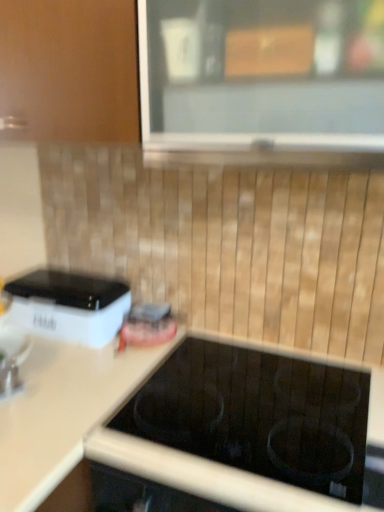
At what (x,y) coordinates should I click in order to perform the action: click on white plastic toaster at left. Please return your answer as a coordinate pair (x, y). Looking at the image, I should click on pyautogui.click(x=69, y=305).

From a real-world perspective, relative to metallic faucet at lower left, is white matte countertop at center vertically above or below?

white matte countertop at center is below metallic faucet at lower left.

Is white matte countertop at center oriented away from metallic faucet at lower left?

No, metallic faucet at lower left is not at the back of white matte countertop at center.

Which is more distant, (x=132, y=382) or (x=25, y=340)?

Positioned behind is point (x=25, y=340).

Is white matte countertop at center situated inside metallic faucet at lower left or outside?

white matte countertop at center exists outside the volume of metallic faucet at lower left.

From a real-world perspective, between white plastic toaster at left and metallic faucet at lower left, who is vertically lower?

From a 3D spatial view, metallic faucet at lower left is below.

Considering the sizes of white plastic toaster at left and metallic faucet at lower left in the image, is white plastic toaster at left bigger or smaller than metallic faucet at lower left?

Considering their sizes, white plastic toaster at left takes up more space than metallic faucet at lower left.

Image resolution: width=384 pixels, height=512 pixels. I want to click on appliance lying on the left of white plastic toaster at left, so click(12, 359).

In the image, is white plastic toaster at left positioned in front of or behind metallic faucet at lower left?

white plastic toaster at left is positioned farther from the viewer than metallic faucet at lower left.

Is point (60, 401) closer or farther from the camera than point (254, 90)?

Point (60, 401) is positioned farther from the camera compared to point (254, 90).

Based on the photo, can you confirm if white matte countertop at center is wider than clear glass window at upper center?

No.

From a real-world perspective, is white matte countertop at center positioned above or below clear glass window at upper center?

From a real-world perspective, white matte countertop at center is physically below clear glass window at upper center.

The width and height of the screenshot is (384, 512). I want to click on window above the white matte countertop at center (from a real-world perspective), so (263, 80).

Between white plastic toaster at left and white matte countertop at center, which one is positioned behind?

white plastic toaster at left is further away from the camera.

Considering the sizes of objects white plastic toaster at left and white matte countertop at center in the image provided, who is smaller, white plastic toaster at left or white matte countertop at center?

With smaller size is white plastic toaster at left.

The width and height of the screenshot is (384, 512). What are the coordinates of `countertop that is on the right side of white plastic toaster at left` in the screenshot? It's located at (59, 413).

Considering the sizes of clear glass window at upper center and metallic faucet at lower left in the image, is clear glass window at upper center bigger or smaller than metallic faucet at lower left?

In the image, clear glass window at upper center appears to be larger than metallic faucet at lower left.

From a real-world perspective, is clear glass window at upper center beneath metallic faucet at lower left?

No, from a real-world perspective, clear glass window at upper center is not under metallic faucet at lower left.

Would you consider clear glass window at upper center to be distant from metallic faucet at lower left?

No, clear glass window at upper center is not far away from metallic faucet at lower left.

Between white plastic toaster at left and clear glass window at upper center, which one has more height?

With more height is clear glass window at upper center.

From the image's perspective, between white plastic toaster at left and clear glass window at upper center, who is located below?

From the image's view, white plastic toaster at left is below.

Is metallic faucet at lower left in contact with white matte countertop at center?

No, metallic faucet at lower left is not touching white matte countertop at center.

Who is smaller, metallic faucet at lower left or white matte countertop at center?

metallic faucet at lower left is smaller.

From a real-world perspective, is metallic faucet at lower left physically located above or below white matte countertop at center?

metallic faucet at lower left is above white matte countertop at center.

Which is closer to the camera, (5, 346) or (13, 415)?

Point (5, 346) is farther from the camera than point (13, 415).

This screenshot has height=512, width=384. What are the coordinates of `appliance behind the white matte countertop at center` in the screenshot? It's located at (12, 359).

Where is `appliance that appears in front of the white plastic toaster at left`? appliance that appears in front of the white plastic toaster at left is located at coordinates (12, 359).

Considering their positions, is clear glass window at upper center positioned further to white plastic toaster at left than metallic faucet at lower left?

clear glass window at upper center is positioned further to the anchor white plastic toaster at left.

Based on their spatial positions, is white matte countertop at center or clear glass window at upper center closer to metallic faucet at lower left?

white matte countertop at center lies closer to metallic faucet at lower left than the other object.

Estimate the real-world distances between objects in this image. Which object is closer to white plastic toaster at left, metallic faucet at lower left or white matte countertop at center?

white matte countertop at center.

Estimate the real-world distances between objects in this image. Which object is further from clear glass window at upper center, metallic faucet at lower left or white matte countertop at center?

Based on the image, metallic faucet at lower left appears to be further to clear glass window at upper center.

From the picture: Considering their positions, is white plastic toaster at left positioned further to clear glass window at upper center than metallic faucet at lower left?

Answer: Among the two, metallic faucet at lower left is located further to clear glass window at upper center.

Considering their positions, is white plastic toaster at left positioned closer to metallic faucet at lower left than clear glass window at upper center?

Based on the image, white plastic toaster at left appears to be nearer to metallic faucet at lower left.

From the image, which object appears to be farther from white plastic toaster at left, white matte countertop at center or clear glass window at upper center?

clear glass window at upper center lies further to white plastic toaster at left than the other object.

Looking at the image, which one is located further to clear glass window at upper center, white matte countertop at center or white plastic toaster at left?

white matte countertop at center is positioned further to the anchor clear glass window at upper center.

The height and width of the screenshot is (512, 384). In order to click on home appliance that lies between clear glass window at upper center and white matte countertop at center from top to bottom in this screenshot , I will do `click(69, 305)`.

Identify the location of home appliance between clear glass window at upper center and metallic faucet at lower left from top to bottom. (69, 305).

I want to click on appliance between clear glass window at upper center and white matte countertop at center in the up-down direction, so click(x=12, y=359).

Where is `appliance between white plastic toaster at left and white matte countertop at center in the up-down direction`? The height and width of the screenshot is (512, 384). appliance between white plastic toaster at left and white matte countertop at center in the up-down direction is located at coordinates (12, 359).